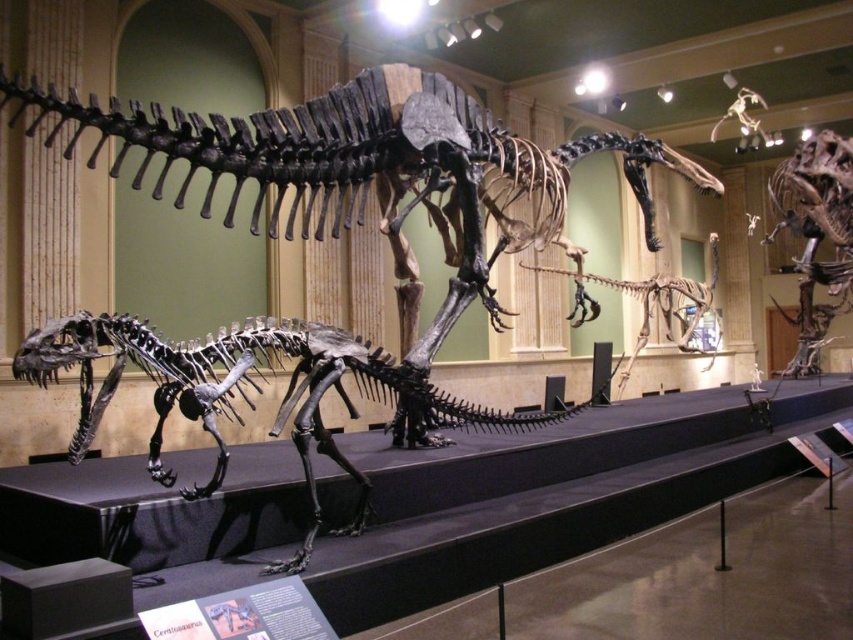
You are standing in the museum exhibit and want to take a photo of the T. rex skeleton. You notice a point at coordinates point (x=527, y=422) that is 4.54 meters away from you. Can you estimate how far you need to move forward to get closer to that point for a better shot?

The point point (x=527, y=422) is 4.54 meters away from you. To get closer, you need to move forward by the desired distance less than 4.54 meters. For example, moving forward 2 meters would bring you to 2.54 meters away from the point.